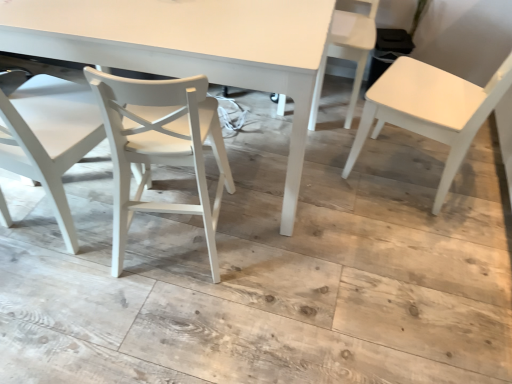
Question: Considering the relative sizes of white matte chair at left, which is counted as the fourth chair, starting from the right, and white plastic chair at upper right, the third chair positioned from the left, in the image provided, is white matte chair at left, which is counted as the fourth chair, starting from the right, bigger than white plastic chair at upper right, the third chair positioned from the left,?

Choices:
 (A) yes
 (B) no

Answer: (A)

Question: Does white matte chair at left, marked as the first chair in a left-to-right arrangement, appear on the left side of white plastic chair at upper right, the 2th chair from the right?

Choices:
 (A) yes
 (B) no

Answer: (A)

Question: Is white matte chair at left, which is counted as the fourth chair, starting from the right, smaller than white plastic chair at upper right, the 2th chair from the right?

Choices:
 (A) no
 (B) yes

Answer: (A)

Question: From a real-world perspective, is white matte chair at left, marked as the first chair in a left-to-right arrangement, physically above white plastic chair at upper right, the third chair positioned from the left?

Choices:
 (A) no
 (B) yes

Answer: (B)

Question: Considering the relative sizes of white matte chair at left, which is counted as the fourth chair, starting from the right, and white plastic chair at upper right, the third chair positioned from the left, in the image provided, is white matte chair at left, which is counted as the fourth chair, starting from the right, wider than white plastic chair at upper right, the third chair positioned from the left,?

Choices:
 (A) yes
 (B) no

Answer: (B)

Question: Considering the relative sizes of white matte chair at left, which is counted as the fourth chair, starting from the right, and white plastic chair at upper right, the 2th chair from the right, in the image provided, is white matte chair at left, which is counted as the fourth chair, starting from the right, taller than white plastic chair at upper right, the 2th chair from the right,?

Choices:
 (A) yes
 (B) no

Answer: (A)

Question: Is white matte table at center positioned with its back to white plastic chair at upper right, the third chair positioned from the left?

Choices:
 (A) no
 (B) yes

Answer: (B)

Question: From the image's perspective, is white matte table at center on top of white plastic chair at upper right, the 2th chair from the right?

Choices:
 (A) no
 (B) yes

Answer: (A)

Question: Can you confirm if white matte table at center is shorter than white plastic chair at upper right, the 2th chair from the right?

Choices:
 (A) no
 (B) yes

Answer: (A)

Question: From a real-world perspective, is white matte table at center below white plastic chair at upper right, the 2th chair from the right?

Choices:
 (A) no
 (B) yes

Answer: (A)

Question: Considering the relative positions of white matte table at center and white plastic chair at upper right, the third chair positioned from the left, in the image provided, is white matte table at center in front of white plastic chair at upper right, the third chair positioned from the left,?

Choices:
 (A) yes
 (B) no

Answer: (A)

Question: From the image's perspective, is white matte table at center under white plastic chair at upper right, the third chair positioned from the left?

Choices:
 (A) no
 (B) yes

Answer: (B)

Question: Is the position of white matte chair at left, marked as the first chair in a left-to-right arrangement, more distant than that of white matte chair at center, marked as the second chair in a left-to-right arrangement?

Choices:
 (A) yes
 (B) no

Answer: (B)